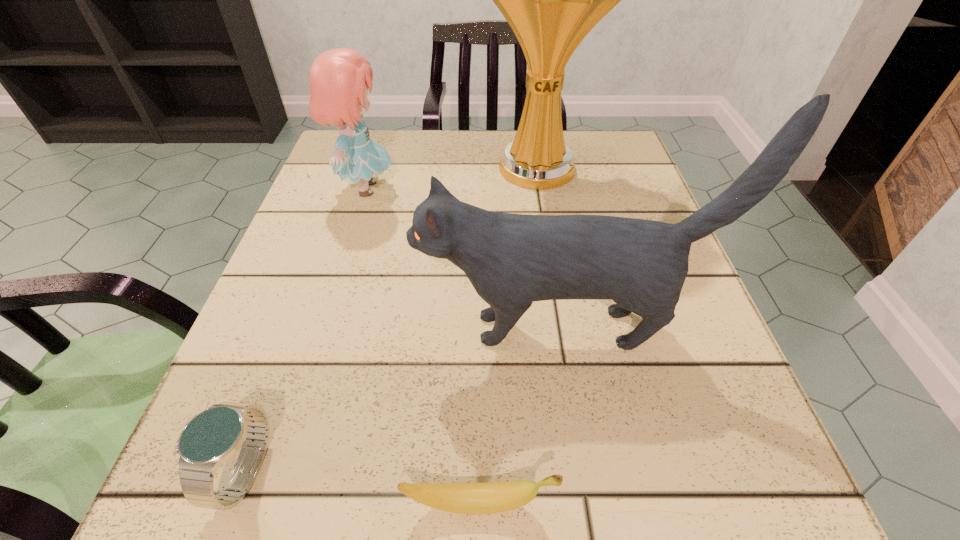
Image resolution: width=960 pixels, height=540 pixels. I want to click on the tallest object, so click(551, 0).

Image resolution: width=960 pixels, height=540 pixels. I want to click on the second tallest object, so click(512, 260).

Image resolution: width=960 pixels, height=540 pixels. Identify the location of the third farthest object. (512, 260).

Locate an element on the screen. Image resolution: width=960 pixels, height=540 pixels. the third tallest object is located at coordinates (340, 78).

Where is `watch`? The height and width of the screenshot is (540, 960). watch is located at coordinates (210, 438).

Image resolution: width=960 pixels, height=540 pixels. In order to click on banana in this screenshot , I will do (464, 498).

Identify the location of vacant space located 0.060m at the front of the tallest object where the globe is prominent. The width and height of the screenshot is (960, 540). (546, 224).

What are the coordinates of `vacant area situated 0.190m at the face of the third nearest object` in the screenshot? It's located at (295, 328).

The width and height of the screenshot is (960, 540). What are the coordinates of `vacant space located at the face of the third nearest object` in the screenshot? It's located at (281, 328).

Image resolution: width=960 pixels, height=540 pixels. I want to click on free space located at the face of the third nearest object, so click(288, 328).